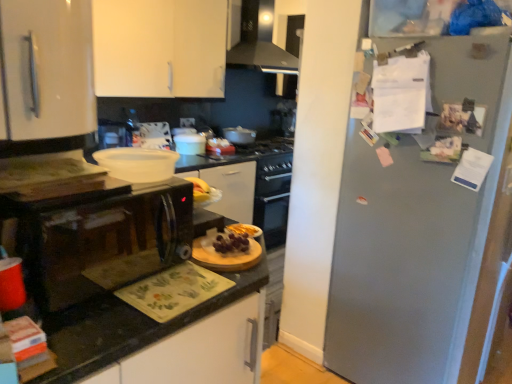
Question: Based on their sizes in the image, would you say metallic gray refrigerator at right is bigger or smaller than black granite countertop at center?

Choices:
 (A) big
 (B) small

Answer: (A)

Question: From the image's perspective, relative to black granite countertop at center, is metallic gray refrigerator at right above or below?

Choices:
 (A) above
 (B) below

Answer: (A)

Question: Which object is the closest to the matte white pot at center, the second appliance in the left-to-right sequence?

Choices:
 (A) black glossy microwave at left
 (B) white matte bowl at center
 (C) white glossy pot at center, placed as the third appliance when sorted from back to front
 (D) black granite countertop at center
 (E) slightly glossy wooden cutting board at center, the first food in the bottom-to-top sequence

Answer: (C)

Question: Considering the real-world distances, which object is farthest from the white matte cabinet at upper left?

Choices:
 (A) metallic silver range hood at upper center
 (B) slightly glossy wooden cutting board at center, the first food in the bottom-to-top sequence
 (C) black glossy microwave at left
 (D) metallic gray refrigerator at right
 (E) white matte bowl at center

Answer: (B)